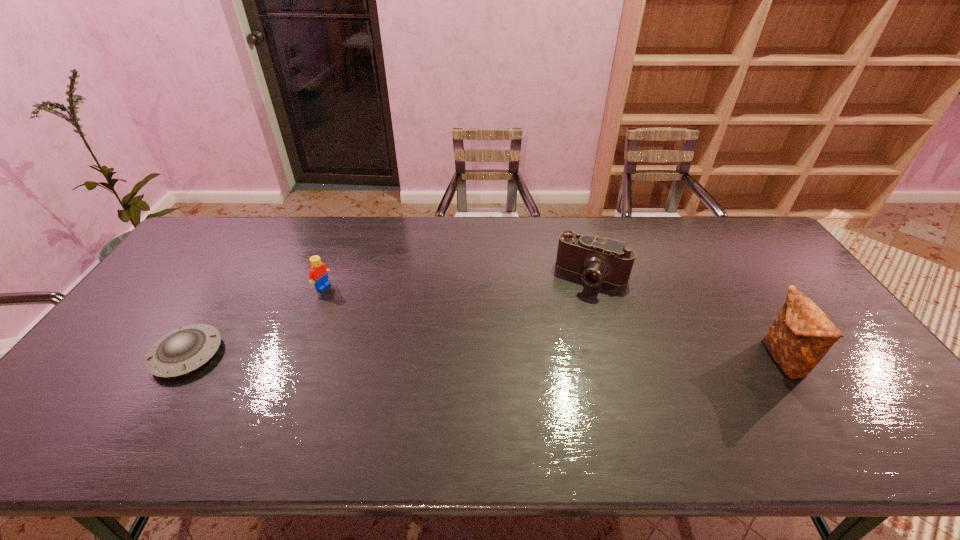
In the image, there is a desktop. Where is `vacant space at the far edge`? This screenshot has width=960, height=540. vacant space at the far edge is located at coordinates (524, 225).

Identify the location of vacant region at the near edge of the desktop. Image resolution: width=960 pixels, height=540 pixels. (349, 410).

You are a GUI agent. You are given a task and a screenshot of the screen. Output one action in this format:
    pyautogui.click(x=<x>, y=<y>)
    Task: Click on the free location at the left edge
    
    Given the screenshot: What is the action you would take?
    pyautogui.click(x=160, y=329)

In order to click on vacant area at the right edge in this screenshot , I will do point(868,373).

Locate an element on the screen. This screenshot has height=540, width=960. free space at the far right corner of the desktop is located at coordinates (756, 230).

Image resolution: width=960 pixels, height=540 pixels. I want to click on vacant space in between the shortest object and the camera, so click(390, 315).

Identify the location of vacant area that lies between the rightmost object and the leftmost object. This screenshot has height=540, width=960. click(485, 357).

Where is `free space between the Lego and the tallest object`? This screenshot has height=540, width=960. free space between the Lego and the tallest object is located at coordinates (552, 323).

The height and width of the screenshot is (540, 960). Identify the location of free point between the shortest object and the tallest object. (485, 357).

You are a GUI agent. You are given a task and a screenshot of the screen. Output one action in this format:
    pyautogui.click(x=<x>, y=<y>)
    Task: Click on the vacant area that lies between the Lego and the camera
    
    Given the screenshot: What is the action you would take?
    pyautogui.click(x=458, y=281)